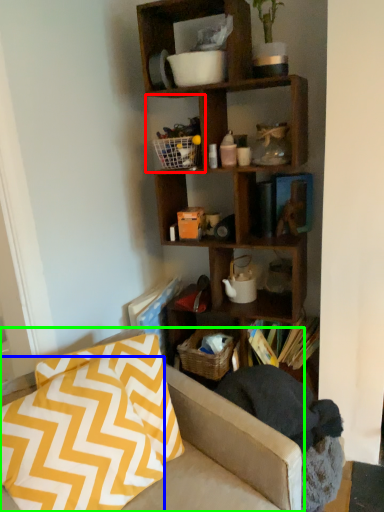
Question: Based on their relative distances, which object is nearer to cabinet (highlighted by a red box)? Choose from pillow (highlighted by a blue box) and studio couch (highlighted by a green box).

Choices:
 (A) pillow
 (B) studio couch

Answer: (B)